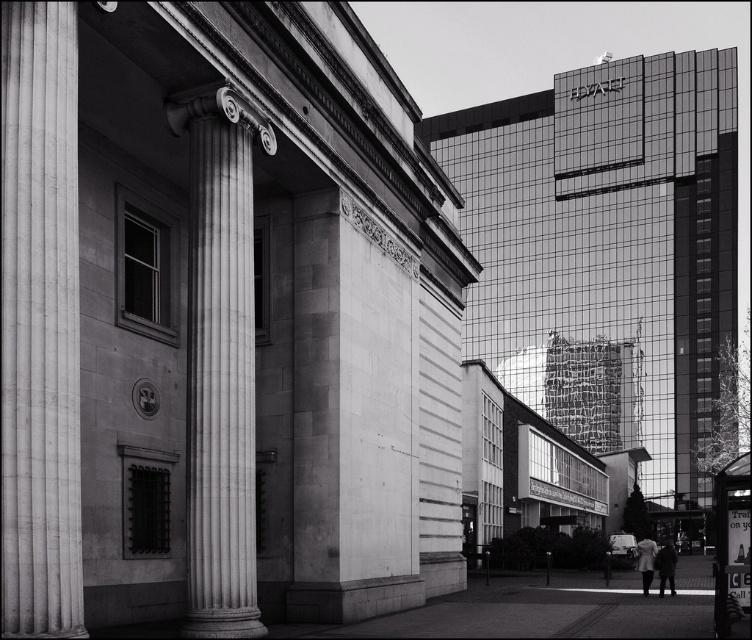
Does smooth stone column at left have a lesser height compared to white marble column at center?

A: Yes, smooth stone column at left is shorter than white marble column at center.

Looking at this image, who is higher up, smooth stone column at left or white marble column at center?

smooth stone column at left is higher up.

Locate an element on the screen. The width and height of the screenshot is (752, 640). smooth stone column at left is located at coordinates coord(41,323).

Find the location of a particular element. This screenshot has height=640, width=752. smooth stone column at left is located at coordinates (41, 323).